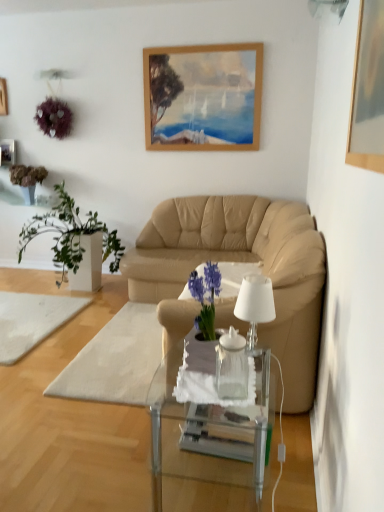
This screenshot has width=384, height=512. I want to click on free space that is in between beige leather couch at center and transparent glass coffee table at center, so click(136, 439).